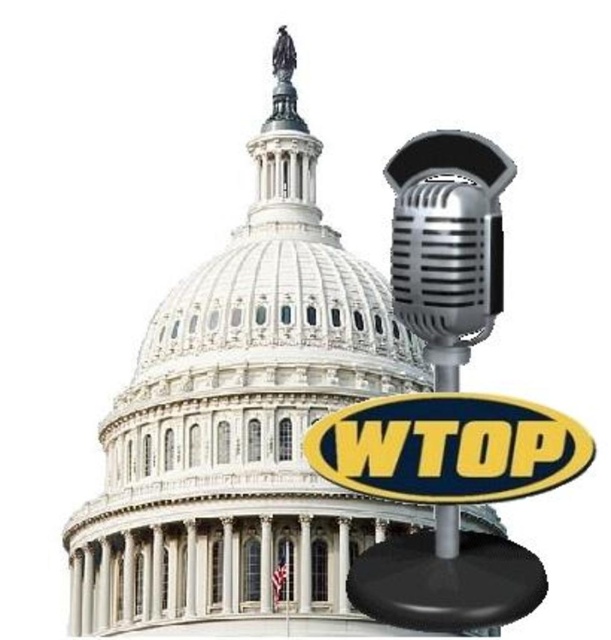
Is the position of shiny silver microphone at right more distant than that of black plastic microphone at right?

Yes, shiny silver microphone at right is behind black plastic microphone at right.

Locate an element on the screen. shiny silver microphone at right is located at coordinates (447, 234).

Which is below, yellowmaterial sign at center or black plastic microphone at right?

Positioned lower is black plastic microphone at right.

Based on the photo, is yellowmaterial sign at center closer to the viewer compared to black plastic microphone at right?

Yes, yellowmaterial sign at center is in front of black plastic microphone at right.

Does point (448, 449) come closer to viewer compared to point (452, 352)?

Yes, point (448, 449) is closer to viewer.

Find the location of `yellowmaterial sign at center`. yellowmaterial sign at center is located at coordinates (447, 448).

Can you confirm if yellowmaterial sign at center is positioned above shiny silver microphone at right?

No, yellowmaterial sign at center is not above shiny silver microphone at right.

Is yellowmaterial sign at center further to camera compared to shiny silver microphone at right?

No, yellowmaterial sign at center is in front of shiny silver microphone at right.

I want to click on yellowmaterial sign at center, so click(447, 448).